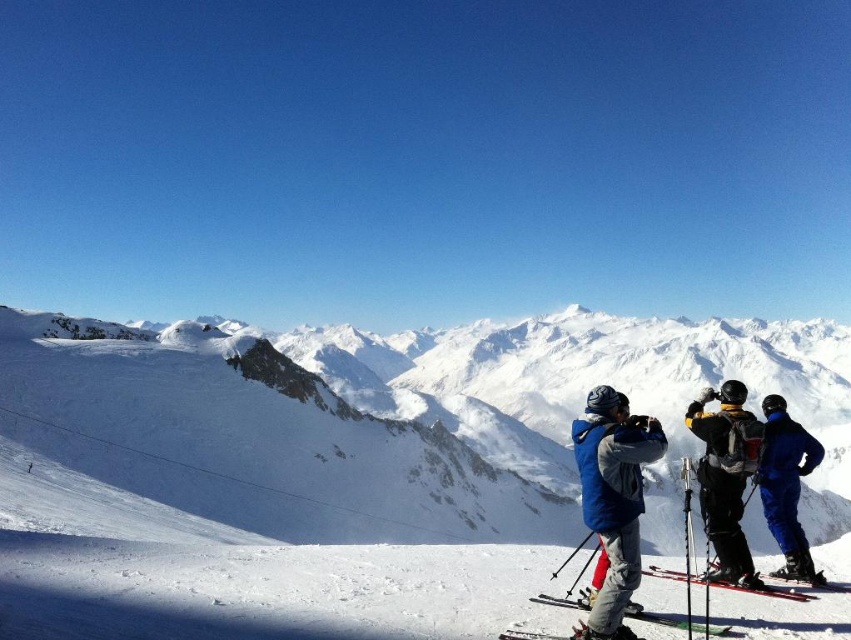
You are a photographer standing at the bottom of the slope. You want to take a photo of both the green matte ski at lower center and the metallic red ski at lower right in the same frame. Which ski should you move closer to the camera so that both are visible in the photo?

The metallic red ski at lower right should be moved closer to the camera because the green matte ski at lower center is already in front of it, so moving the metallic red ski forward will ensure both are visible in the photo.